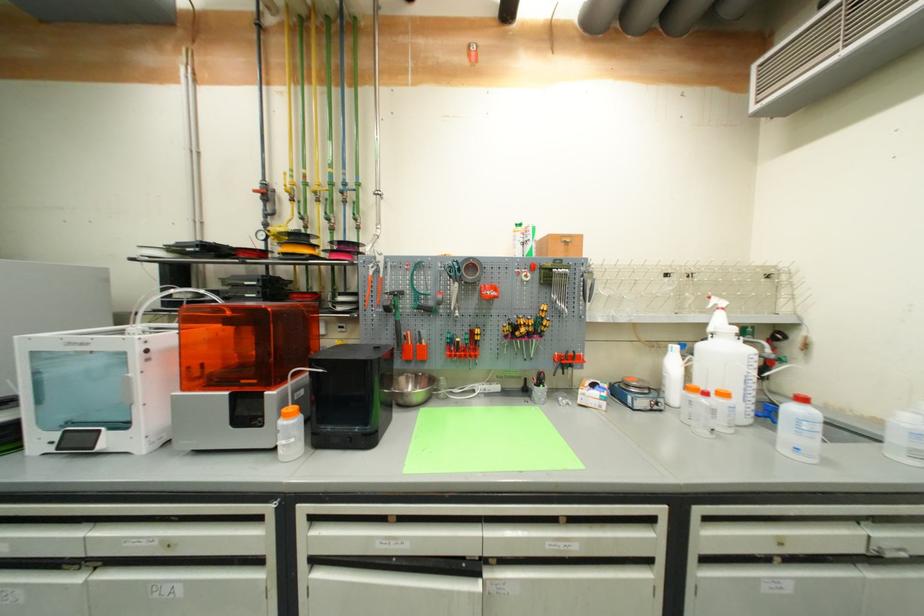
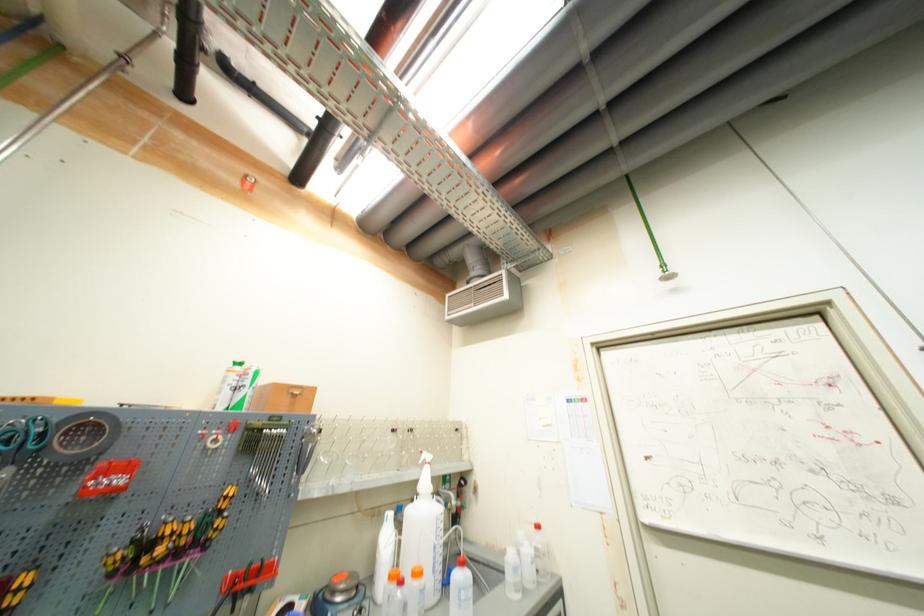
The point at (711, 326) is marked in the first image. Where is the corresponding point in the second image?

(421, 484)